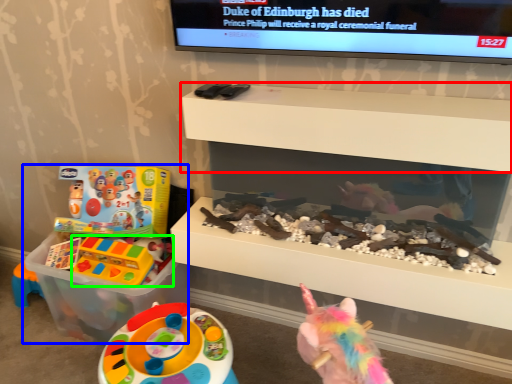
Question: Which object is positioned closest to shelf (highlighted by a red box)? Select from toy (highlighted by a blue box) and toy (highlighted by a green box).

Choices:
 (A) toy
 (B) toy

Answer: (A)